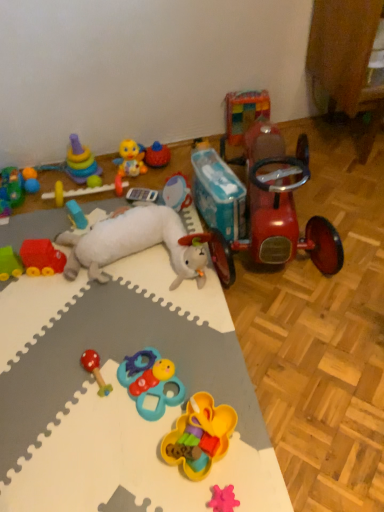
The width and height of the screenshot is (384, 512). Identify the location of free spot below rubberized plastic toy at center, the tenth toy positioned from the right (from a real-world perspective). (102, 195).